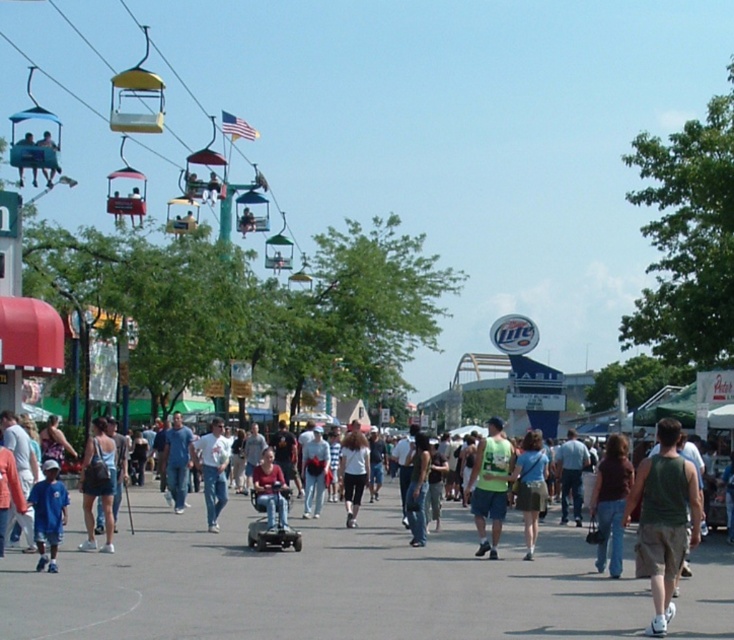
You are a fair attendee who needs to navigate through the crowd to reach the gondola lift. You see the matte blue wheelchair at center and the matte black helmet at upper left. Which object is shorter in height?

The matte blue wheelchair at center is shorter in height compared to the matte black helmet at upper left.

You are a fashion designer observing the crowd at the fair. You notice two people wearing denim shorts at center and denim skirt at center. Which clothing item is smaller in size?

The denim shorts at center has a smaller size compared to the denim skirt at center.